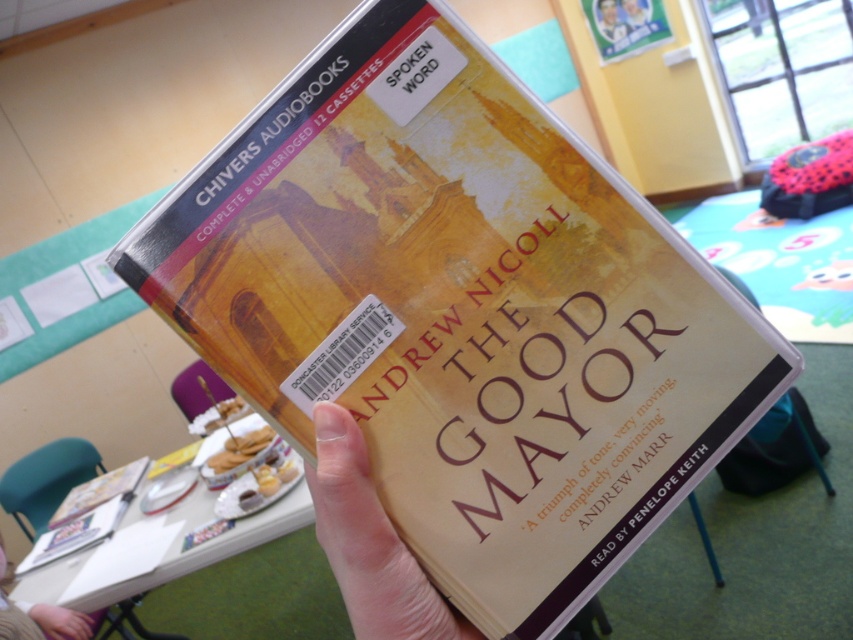
You are standing in front of the book display at the community center and notice two points marked on the wall. The first point is at coordinate point (65, 616) and the second is at point (68, 516). Which point is closer to you?

Point (65, 616) is closer to you than point (68, 516).

You are a photographer trying to capture the smooth beige hand at center holding the book. If your camera requires the subject to be at least 40 centimeters away to focus properly, will you need to adjust your position?

The smooth beige hand at center is only 35.43 centimeters away from the camera, which is less than the required 40 centimeters for proper focus. Therefore, you need to move further back to increase the distance.

You are a librarian who needs to place the hardcover book at center back on the shelf. You notice your smooth beige hand at center is currently holding it. Can you safely place the book back without dropping it?

The distance between the smooth beige hand at center and the hardcover book at center is 2.32 meters, which means the hand is not holding the book. Therefore, the book might already be on the shelf or somewhere else, so you need to check its position before attempting to place it back.